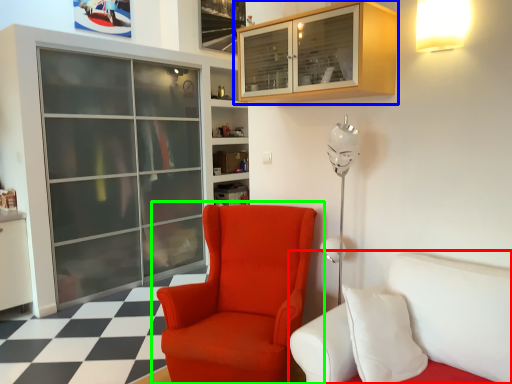
Question: Estimate the real-world distances between objects in this image. Which object is farther from studio couch (highlighted by a red box), cabinetry (highlighted by a blue box) or chair (highlighted by a green box)?

Choices:
 (A) cabinetry
 (B) chair

Answer: (A)